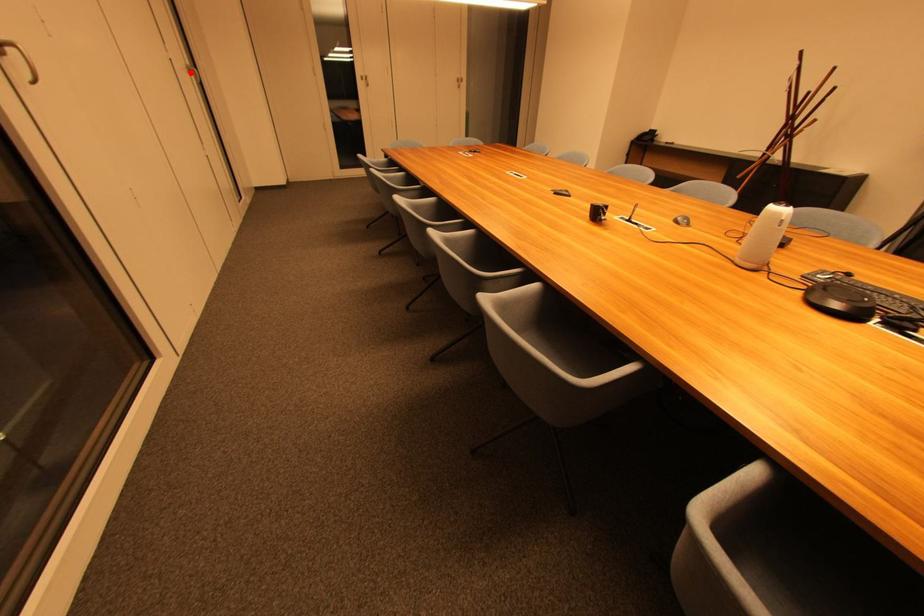
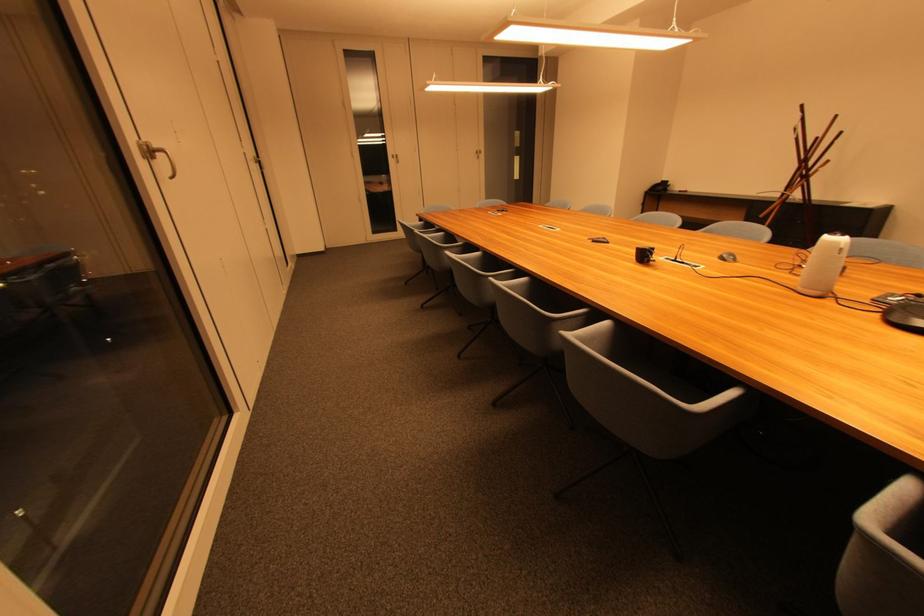
The point at the highlighted location is marked in the first image. Where is the corresponding point in the second image?

(259, 163)